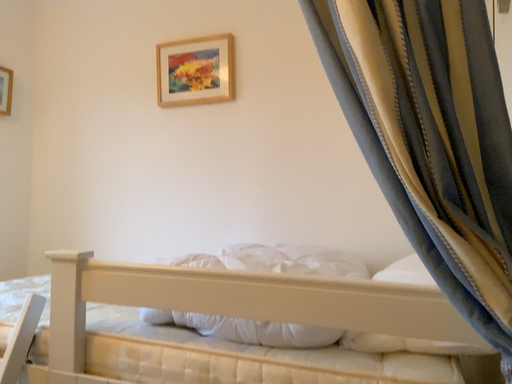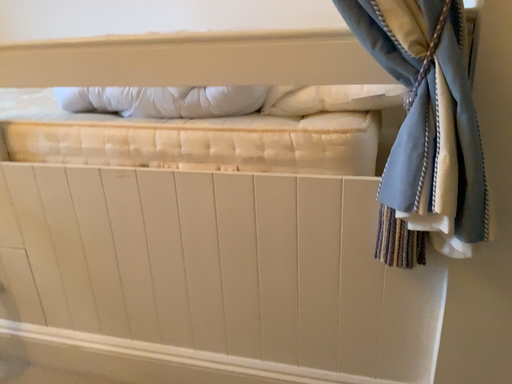
Question: Which way did the camera rotate in the video?

Choices:
 (A) rotated upward
 (B) rotated downward

Answer: (B)